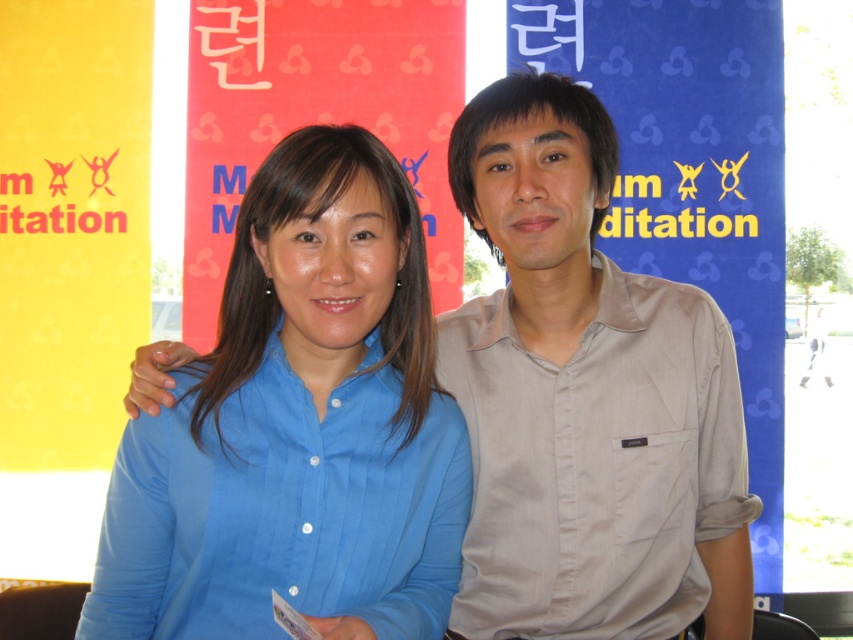
Question: Does matte beige shirt at center come behind beige cotton shirt at right?

Choices:
 (A) no
 (B) yes

Answer: (B)

Question: Which point is farther to the camera?

Choices:
 (A) beige cotton shirt at right
 (B) matte beige shirt at center

Answer: (B)

Question: Can you confirm if matte beige shirt at center is bigger than beige cotton shirt at right?

Choices:
 (A) no
 (B) yes

Answer: (B)

Question: Based on their relative distances, which object is farther from the blue smooth shirt at center?

Choices:
 (A) matte beige shirt at center
 (B) beige cotton shirt at right

Answer: (A)

Question: Which point is closer to the camera taking this photo?

Choices:
 (A) (642, 493)
 (B) (637, 371)
 (C) (288, 266)

Answer: (C)

Question: Observing the image, what is the correct spatial positioning of blue smooth shirt at center in reference to matte beige shirt at center?

Choices:
 (A) right
 (B) left

Answer: (B)